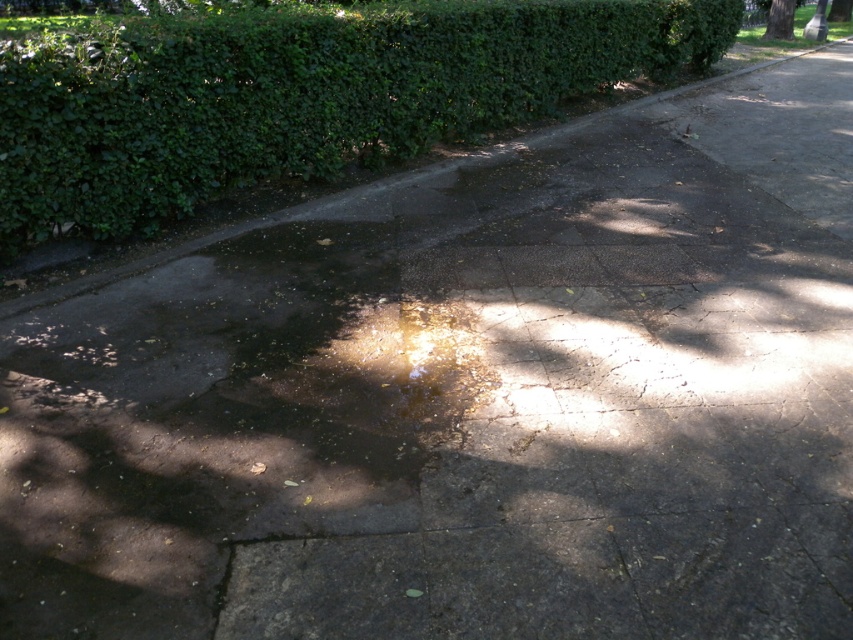
You are planning to place a small bench between the green leafy hedge at upper left and the green leafy tree at upper right. Which side of the bench should face the wider object to ensure it is closer to the larger structure?

The green leafy hedge at upper left might be wider than green leafy tree at upper right. Therefore, the bench should be positioned so that its side faces the green leafy hedge at upper left to be closer to the potentially wider structure.

You are planning to install a bench in the park that is 10 feet long. The bench needs to be placed between the green leafy hedge at upper left and the green leafy tree at upper right. Is there enough space between them to fit the bench?

The green leafy hedge at upper left and green leafy tree at upper right are 40.16 feet apart from each other. Since the bench is 10 feet long, there is sufficient space between them to accommodate the bench.

You are a gardener planning to trim both the green leafy hedge at upper left and the green leafy tree at upper right. Which one do you think will require more time and effort due to its size?

The green leafy hedge at upper left is larger in size than the green leafy tree at upper right, so it will require more time and effort to trim.